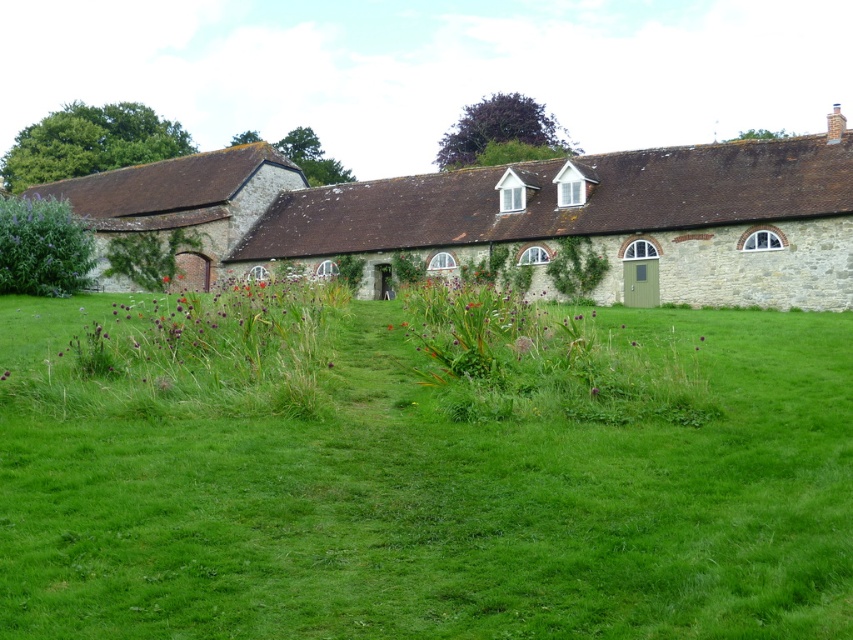
You are standing on the green grass at center and want to walk to the stone cottage at center. Which direction should you go to reach the cottage?

The stone cottage at center is wider than the green grass at center, so you should walk towards the direction of the stone cottage at center to reach it.

You are planning to build a new garden shed between the stone cottage at center and the brown stone cottage at left. Which cottage should the shed be closer to if you want it to be equidistant from both cottages but also ensure it doesn

The shed should be placed closer to the brown stone cottage at left because the stone cottage at center is wider, so positioning it nearer to the narrower brown stone cottage at left will help maintain equal distance between both cottages while accommodating the width difference.